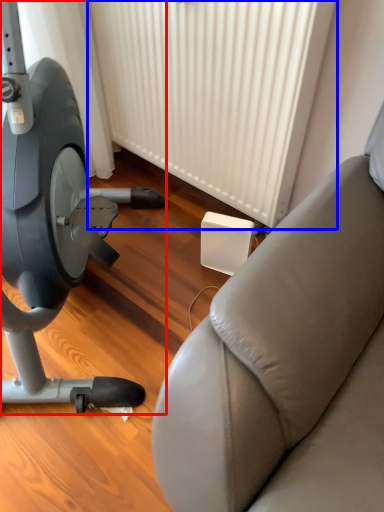
Question: Which point is closer to the camera, stationary bicycle (highlighted by a red box) or radiator (highlighted by a blue box)?

Choices:
 (A) stationary bicycle
 (B) radiator

Answer: (A)